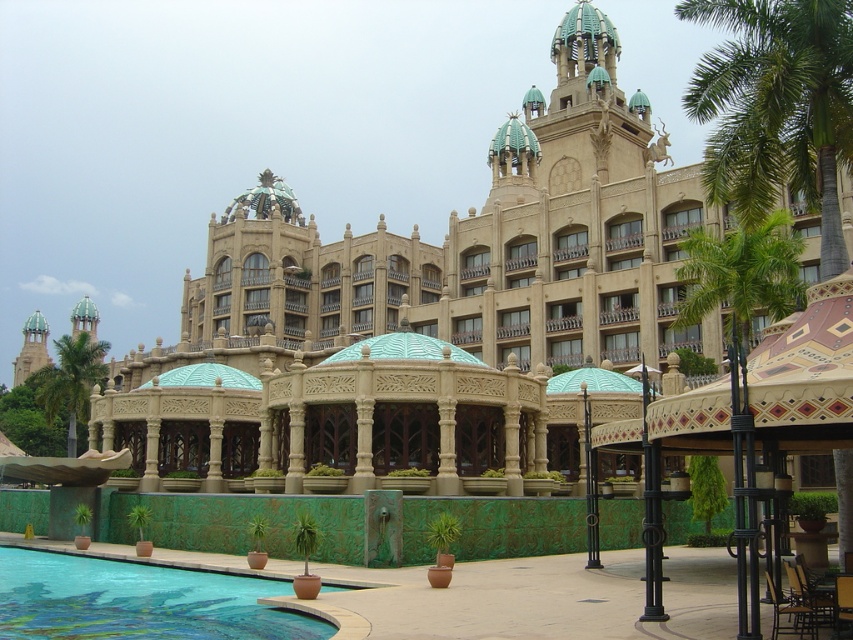
Question: Based on their relative distances, which object is nearer to the green leafy palm tree at left?

Choices:
 (A) green leafy palm tree at upper right
 (B) blue mosaic tiles at lower left

Answer: (B)

Question: Which point is farther to the camera?

Choices:
 (A) green leafy palm tree at upper right
 (B) green leafy palm tree at left

Answer: (B)

Question: Is green leafy palm tree at upper right to the left of blue mosaic tiles at lower left from the viewer's perspective?

Choices:
 (A) yes
 (B) no

Answer: (B)

Question: From the image, what is the correct spatial relationship of green leafy palm tree at upper right in relation to blue mosaic tiles at lower left?

Choices:
 (A) right
 (B) left

Answer: (A)

Question: Among these objects, which one is nearest to the camera?

Choices:
 (A) blue mosaic tiles at lower left
 (B) green leafy palm tree at upper right

Answer: (A)

Question: Does green leafy palm tree at upper right lie behind blue mosaic tiles at lower left?

Choices:
 (A) no
 (B) yes

Answer: (B)